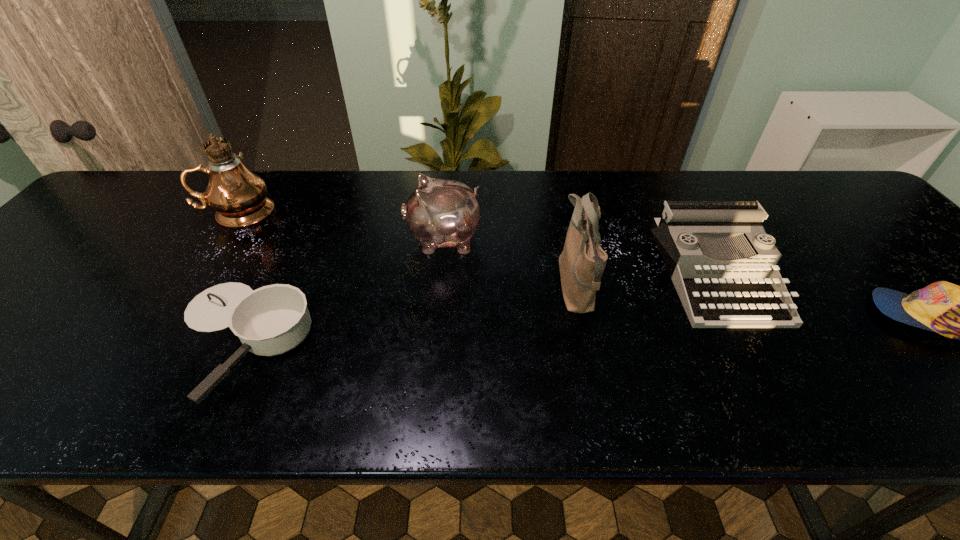
This screenshot has height=540, width=960. What are the coordinates of `object that is the fourth closest to the second tallest object` in the screenshot? It's located at (959, 312).

I want to click on free location that satisfies the following two spatial constraints: 1. on the front facing side of the third tallest object; 2. on the front side of the saucepan, so click(x=435, y=340).